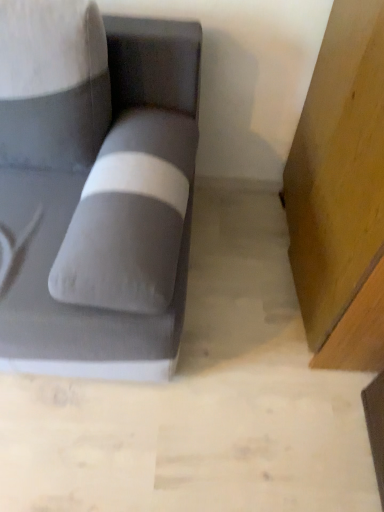
The width and height of the screenshot is (384, 512). What do you see at coordinates (103, 207) in the screenshot?
I see `suede gray couch at center` at bounding box center [103, 207].

Image resolution: width=384 pixels, height=512 pixels. I want to click on suede gray couch at center, so click(103, 207).

The width and height of the screenshot is (384, 512). Identify the location of suede gray couch at center. (103, 207).